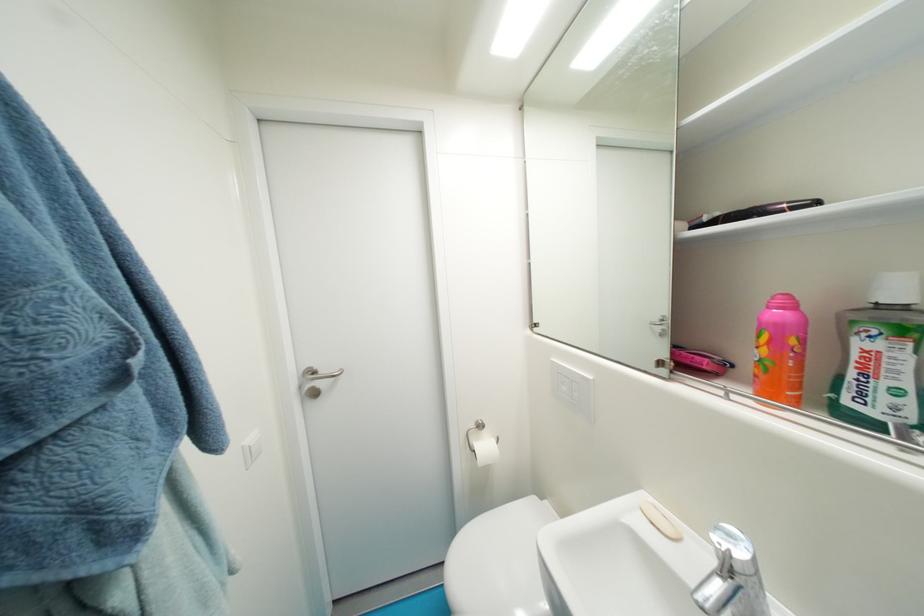
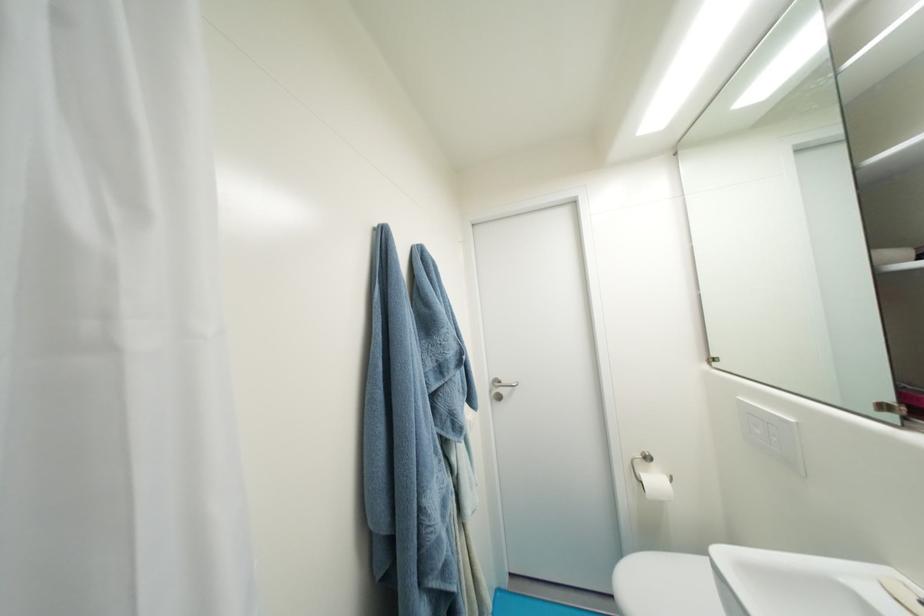
Question: How did the camera likely rotate?

Choices:
 (A) Left
 (B) Right
 (C) Up
 (D) Down

Answer: (A)